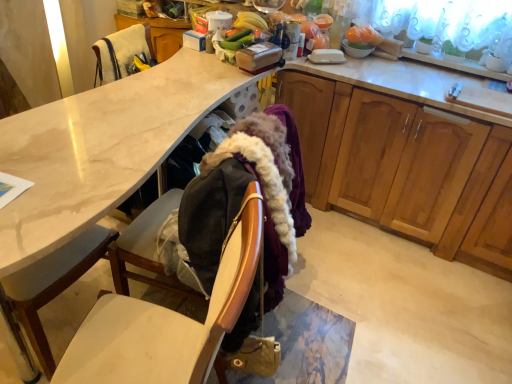
I want to click on free spot in front of matte white cup at upper center, so click(203, 58).